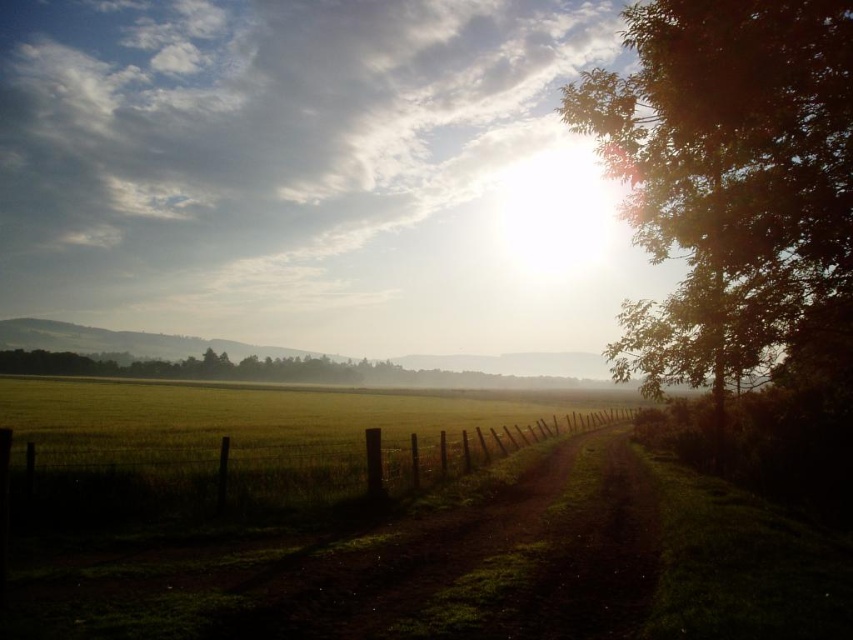
You are standing on the dirt path and want to walk towards the wooden fence at center. Is the green leafy tree at right blocking your path?

The green leafy tree at right is in front of the wooden fence at center, so it is blocking your path.

Based on the photo, you are a hiker trying to find shade on this sunny day. You see a green leafy tree at right and a dull brown dirt track at center. Which object would provide more shade?

The green leafy tree at right has a larger size compared to the dull brown dirt track at center, so it would provide more shade.